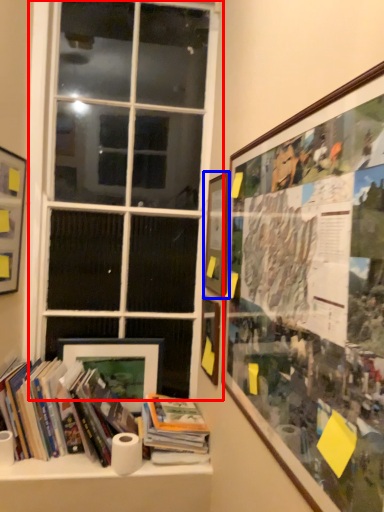
Question: Which object appears farthest to the camera in this image, window (highlighted by a red box) or picture frame (highlighted by a blue box)?

Choices:
 (A) window
 (B) picture frame

Answer: (A)